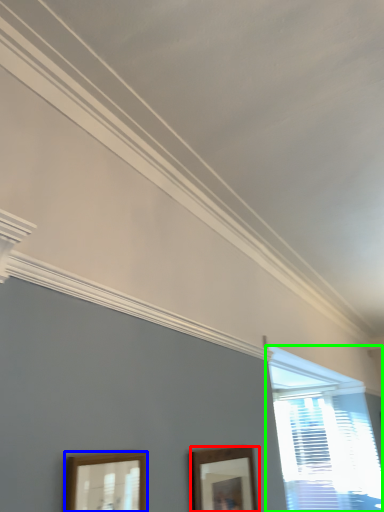
Question: Which is nearer to the picture frame (highlighted by a red box)? picture frame (highlighted by a blue box) or window (highlighted by a green box).

Choices:
 (A) picture frame
 (B) window

Answer: (A)